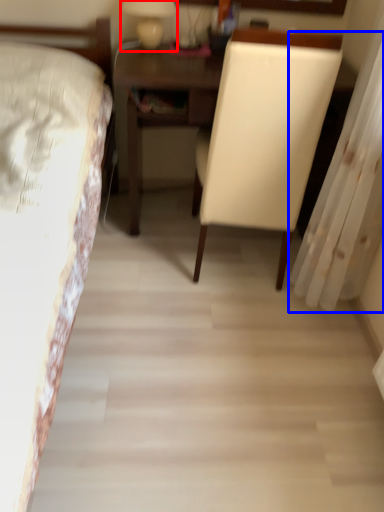
Question: Among these objects, which one is nearest to the camera, bedside lamp (highlighted by a red box) or curtain (highlighted by a blue box)?

Choices:
 (A) bedside lamp
 (B) curtain

Answer: (B)